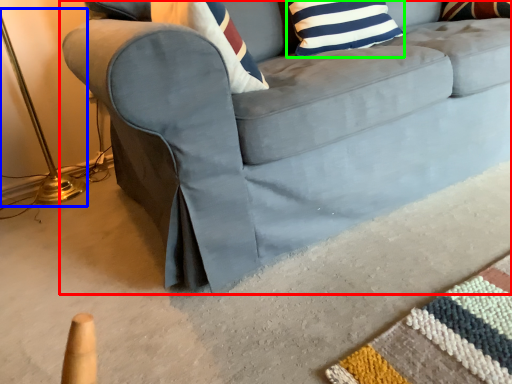
Question: Which is farther away from studio couch (highlighted by a red box)? table lamp (highlighted by a blue box) or pillow (highlighted by a green box)?

Choices:
 (A) table lamp
 (B) pillow

Answer: (A)